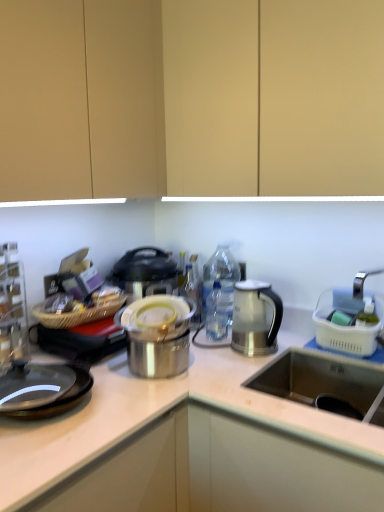
You are a GUI agent. You are given a task and a screenshot of the screen. Output one action in this format:
    pyautogui.click(x=<x>, y=<y>)
    Task: Click on the vacant space in shiny metallic pot at center, positioned as the 2th appliance in right-to-left order (from a real-world perspective)
    The height and width of the screenshot is (512, 384).
    Given the screenshot: What is the action you would take?
    pyautogui.click(x=151, y=372)